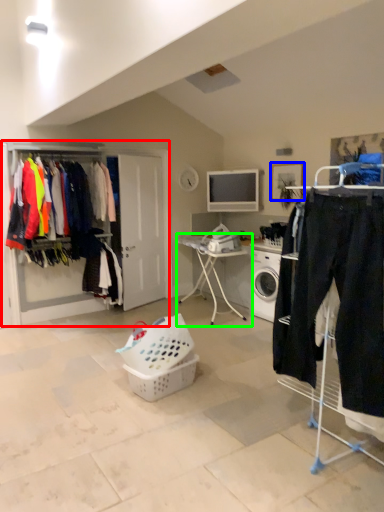
Question: Estimate the real-world distances between objects in this image. Which object is closer to dresser (highlighted by a red box), picture frame (highlighted by a blue box) or desk (highlighted by a green box)?

Choices:
 (A) picture frame
 (B) desk

Answer: (B)